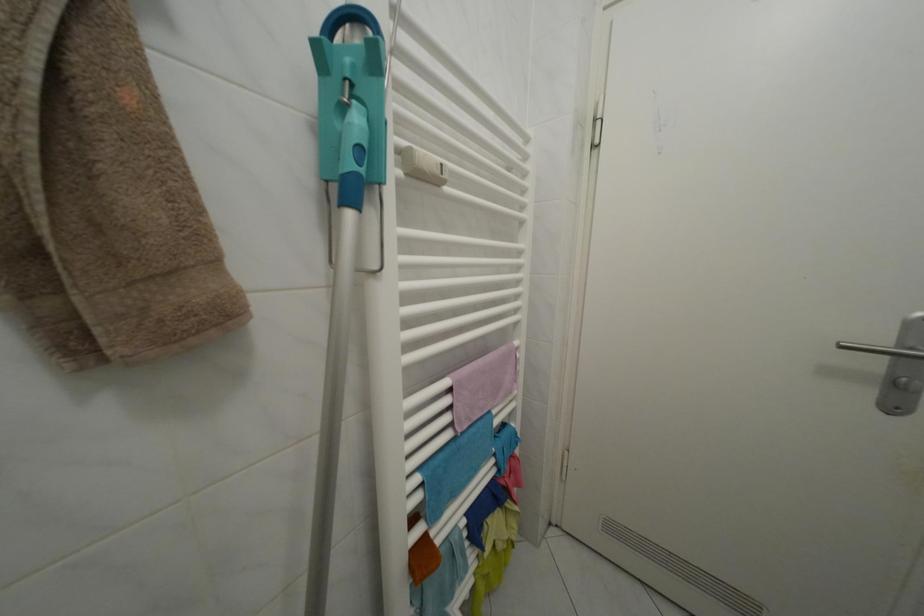
Where would you push the silver door handle? Please return your answer as a coordinate pair (x, y).

(882, 350)